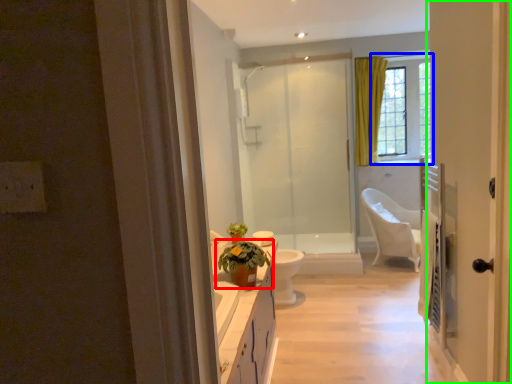
Question: Estimate the real-world distances between objects in this image. Which object is closer to houseplant (highlighted by a red box), window (highlighted by a blue box) or door (highlighted by a green box)?

Choices:
 (A) window
 (B) door

Answer: (B)